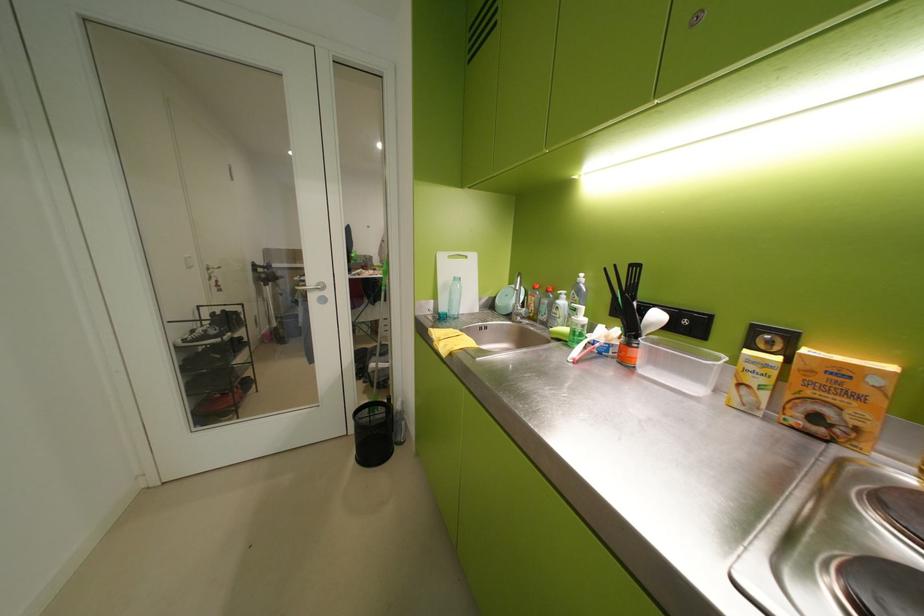
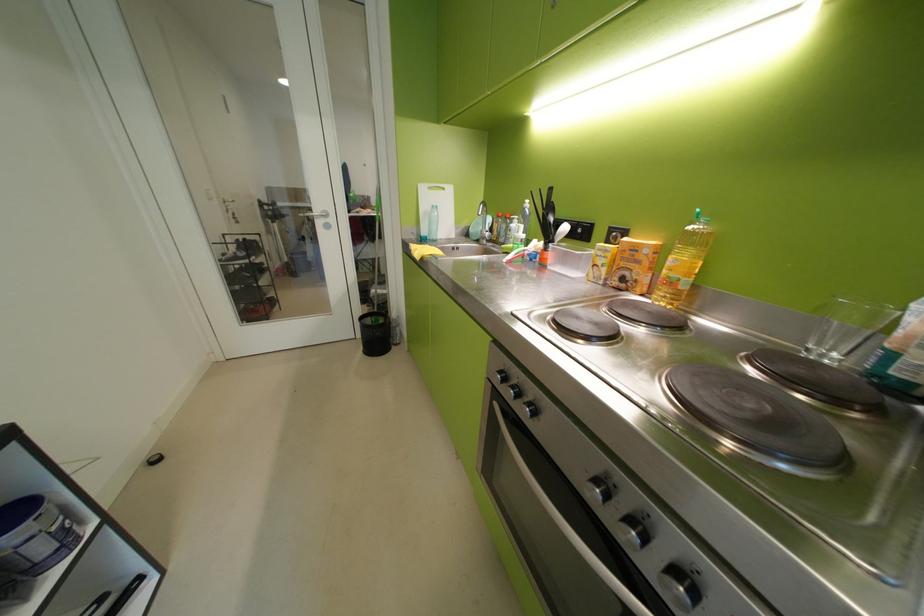
In the second image, find the point that corresponds to (494,301) in the first image.

(470, 230)